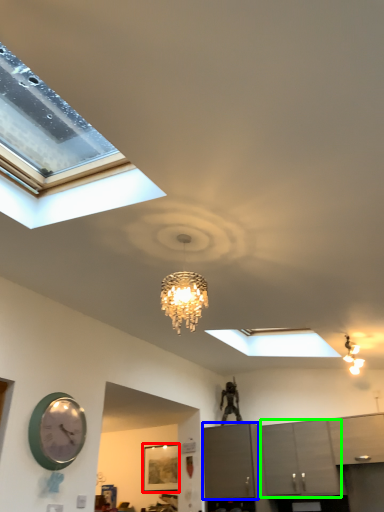
Question: Considering the real-world distances, which object is closest to picture frame (highlighted by a red box)? cabinetry (highlighted by a blue box) or cabinetry (highlighted by a green box).

Choices:
 (A) cabinetry
 (B) cabinetry

Answer: (A)